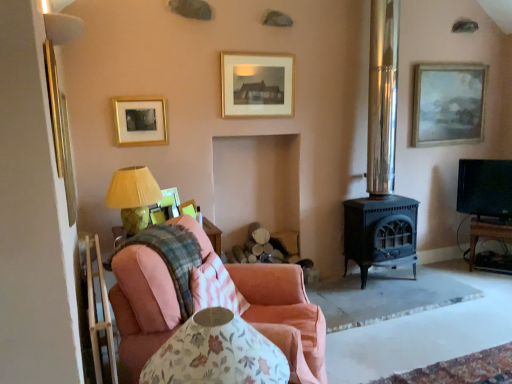
Where is `free spot in front of polished metal stove at center-right`? The width and height of the screenshot is (512, 384). free spot in front of polished metal stove at center-right is located at coordinates (397, 297).